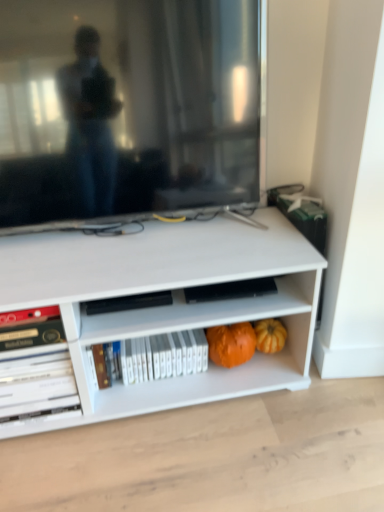
Question: From the image's perspective, is orange matte pumpkin at lower center, the second pumpkin viewed from the right, beneath orange matte pumpkin at lower right, placed as the 2th pumpkin when sorted from left to right?

Choices:
 (A) no
 (B) yes

Answer: (A)

Question: Does orange matte pumpkin at lower center, the second pumpkin viewed from the right, have a larger size compared to orange matte pumpkin at lower right, placed as the 2th pumpkin when sorted from left to right?

Choices:
 (A) no
 (B) yes

Answer: (B)

Question: Are orange matte pumpkin at lower center, which is the first pumpkin in left-to-right order, and orange matte pumpkin at lower right, placed as the 1th pumpkin when sorted from right to left, making contact?

Choices:
 (A) yes
 (B) no

Answer: (B)

Question: Does orange matte pumpkin at lower center, which is the first pumpkin in left-to-right order, have a lesser height compared to orange matte pumpkin at lower right, placed as the 2th pumpkin when sorted from left to right?

Choices:
 (A) no
 (B) yes

Answer: (A)

Question: Is orange matte pumpkin at lower center, which is the first pumpkin in left-to-right order, taller than orange matte pumpkin at lower right, placed as the 1th pumpkin when sorted from right to left?

Choices:
 (A) no
 (B) yes

Answer: (B)

Question: Considering their positions, is orange matte pumpkin at lower right, placed as the 2th pumpkin when sorted from left to right, located in front of or behind matte black television at upper center?

Choices:
 (A) front
 (B) behind

Answer: (B)

Question: Is point (264, 324) closer or farther from the camera than point (124, 148)?

Choices:
 (A) closer
 (B) farther

Answer: (B)

Question: From the image's perspective, is orange matte pumpkin at lower right, placed as the 2th pumpkin when sorted from left to right, positioned above or below matte black television at upper center?

Choices:
 (A) above
 (B) below

Answer: (B)

Question: Based on their sizes in the image, would you say orange matte pumpkin at lower right, placed as the 2th pumpkin when sorted from left to right, is bigger or smaller than matte black television at upper center?

Choices:
 (A) small
 (B) big

Answer: (A)

Question: From a real-world perspective, relative to white glossy book at lower left, the first book from the left, is matte black television at upper center vertically above or below?

Choices:
 (A) above
 (B) below

Answer: (A)

Question: From the image's perspective, is matte black television at upper center located above or below white glossy book at lower left, the first book from the left?

Choices:
 (A) below
 (B) above

Answer: (B)

Question: Considering the relative positions of matte black television at upper center and white glossy book at lower left, the first book from the left, in the image provided, is matte black television at upper center to the left or to the right of white glossy book at lower left, the first book from the left,?

Choices:
 (A) left
 (B) right

Answer: (B)

Question: In the image, is matte black television at upper center positioned in front of or behind white glossy book at lower left, the first book from the left?

Choices:
 (A) front
 (B) behind

Answer: (A)

Question: From the image's perspective, is matte black television at upper center located above or below orange matte pumpkin at lower center, which is the first pumpkin in left-to-right order?

Choices:
 (A) above
 (B) below

Answer: (A)

Question: Is matte black television at upper center inside or outside of orange matte pumpkin at lower center, the second pumpkin viewed from the right?

Choices:
 (A) outside
 (B) inside

Answer: (A)